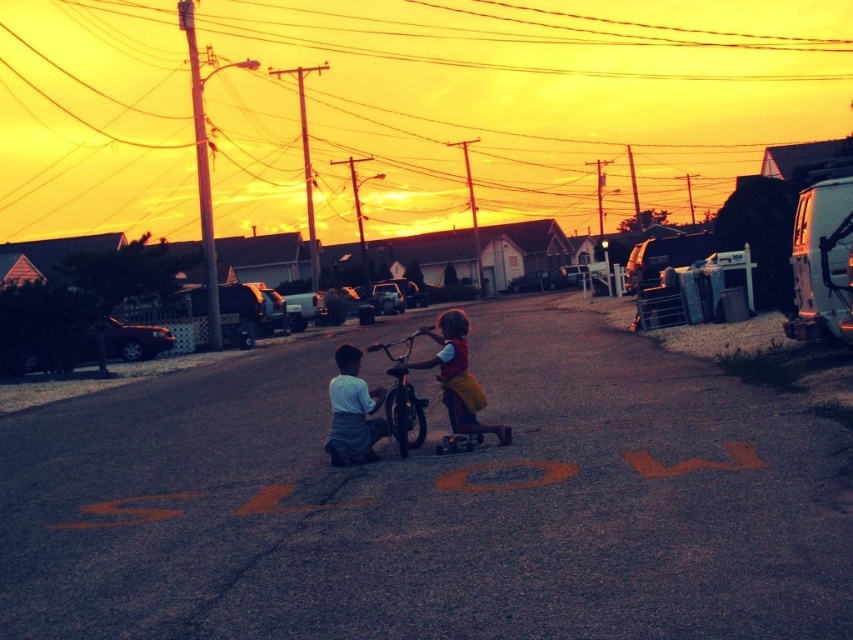
You are a delivery person who needs to cross the road where the matte white shirt at center and metallic silver bicycle at center are located. The road is 5 meters wide. Can you safely cross the road without stepping on either object?

The distance between the matte white shirt at center and the metallic silver bicycle at center is 4.70 meters. Since the road is 5 meters wide, there is enough space to cross safely by moving around both objects.

You are standing at the camera position and want to place a small flag at the closest point between point (360, 400) and point (398, 410). Which point should you choose?

Point (360, 400) is closer to the camera than point (398, 410), so you should place the flag at point (360, 400).

You are a photographer trying to capture a closeup shot of the matte yellow shorts at center. What coordinates should you aim your camera at to ensure the shorts are centered in the frame?

The coordinates to aim the camera at are point (457, 378) to center the matte yellow shorts at center in the frame.